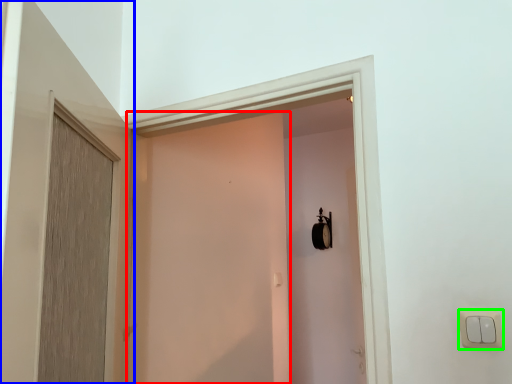
Question: Estimate the real-world distances between objects in this image. Which object is closer to screen door (highlighted by a red box), door (highlighted by a blue box) or light switch (highlighted by a green box)?

Choices:
 (A) door
 (B) light switch

Answer: (A)